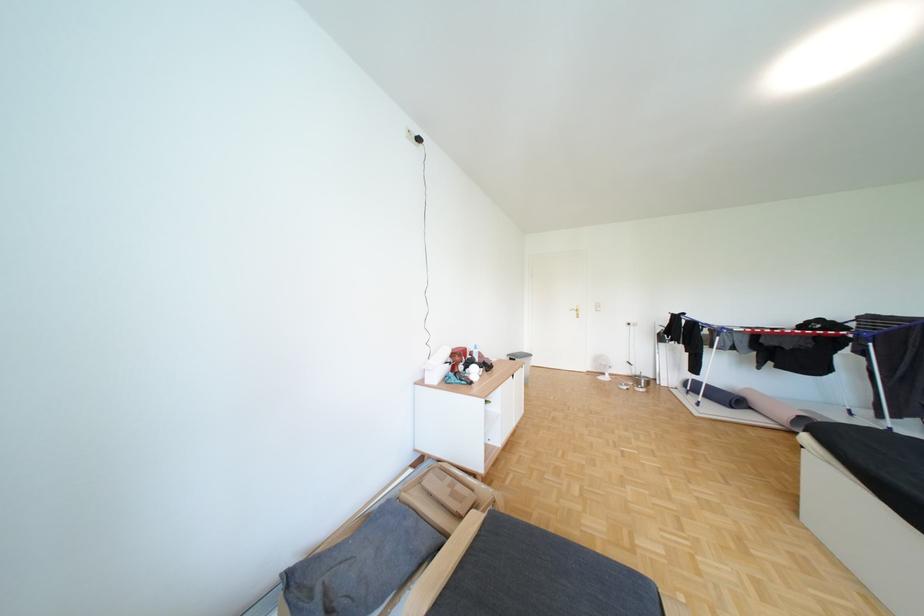
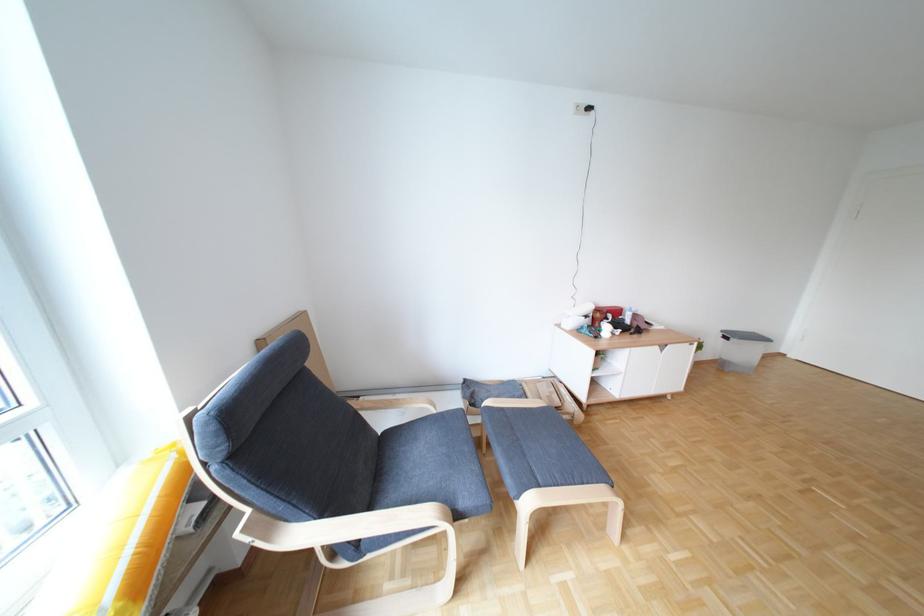
In the second image, find the point that corresponds to pixel 472 359 in the first image.

(614, 315)